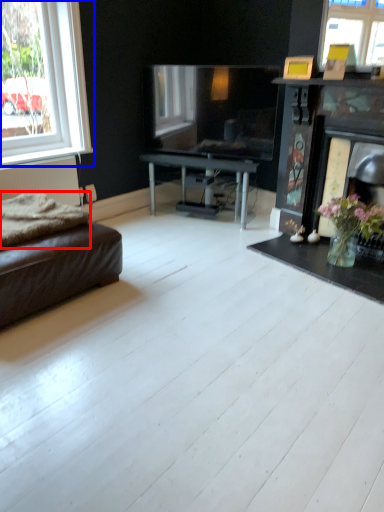
Question: Among these objects, which one is nearest to the camera, blanket (highlighted by a red box) or window (highlighted by a blue box)?

Choices:
 (A) blanket
 (B) window

Answer: (A)